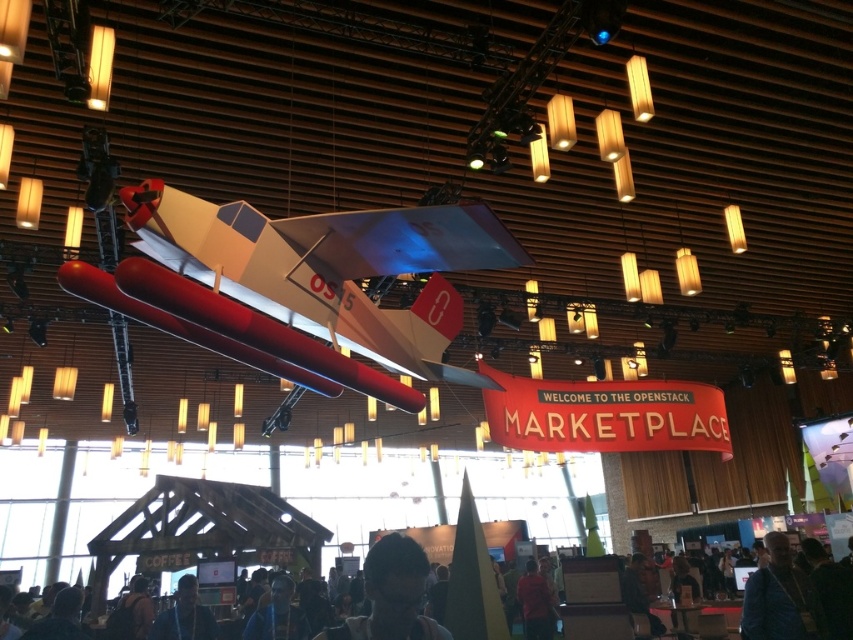
You are standing in the event space and want to take a photo of the large model airplane mounted on a stand. There is a point at coordinate [434,636] that is 2.17 meters away from you. If you move forward 1.5 meters towards the airplane, will you be closer than 1 meter to the point?

After moving forward 1.5 meters towards the airplane, your distance to the point becomes 2.17 meters minus 1.5 meters, which equals 0.67 meters. Since 0.67 meters is less than 1 meter, you will be closer than 1 meter to the point.

You are standing in the event space and see the dark hair at lower center and the dark blue shirt at lower center. Which one is closer to you?

The dark hair at lower center is closer to the viewer than the dark blue shirt at lower center.

You are an event planner arranging a photo shoot in the conference hall. You need to position a camera so that both the blue fabric jacket at lower right and the dark gray shirt at lower center are visible in the frame. Based on their positions, which object should be placed closer to the camera to ensure both are in focus?

The blue fabric jacket at lower right is located above the dark gray shirt at lower center. To ensure both are in focus, the camera should be positioned so that the dark gray shirt at lower center is closer to the camera since it is lower and the jacket is above it, requiring depth of field adjustment.